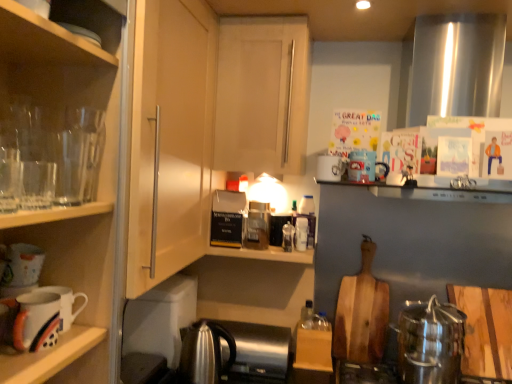
Question: Is point (286, 226) closer or farther from the camera than point (55, 34)?

Choices:
 (A) farther
 (B) closer

Answer: (A)

Question: Looking at their shapes, would you say translucent plastic bottle at shelf center, marked as the second bottle in a back-to-front arrangement, is wider or thinner than transparent glass cabinet at left, arranged as the 2th cabinetry when viewed from the right?

Choices:
 (A) wide
 (B) thin

Answer: (B)

Question: Estimate the real-world distances between objects in this image. Which object is farther from the wooden cutting board at center-right, acting as the 2th cutting board starting from the right?

Choices:
 (A) satin silver kettle at lower center
 (B) white glossy mug at lower left, which is the second mug in right-to-left order
 (C) satin silver kettle at lower right
 (D) transparent glassware at left
 (E) satin silver kettle at lower center

Answer: (D)

Question: Which of these objects is positioned farthest from the satin silver kettle at lower center?

Choices:
 (A) white matte cabinet door at center, which is counted as the 2th cabinetry, starting from the left
 (B) white glossy mug at upper center, arranged as the 1th mug when viewed from the back
 (C) translucent plastic bottle at shelf center, marked as the second bottle in a back-to-front arrangement
 (D) wooden cutting board at center-right, acting as the 2th cutting board starting from the right
 (E) white glossy mug at lower left, positioned as the second mug in left-to-right order

Answer: (A)